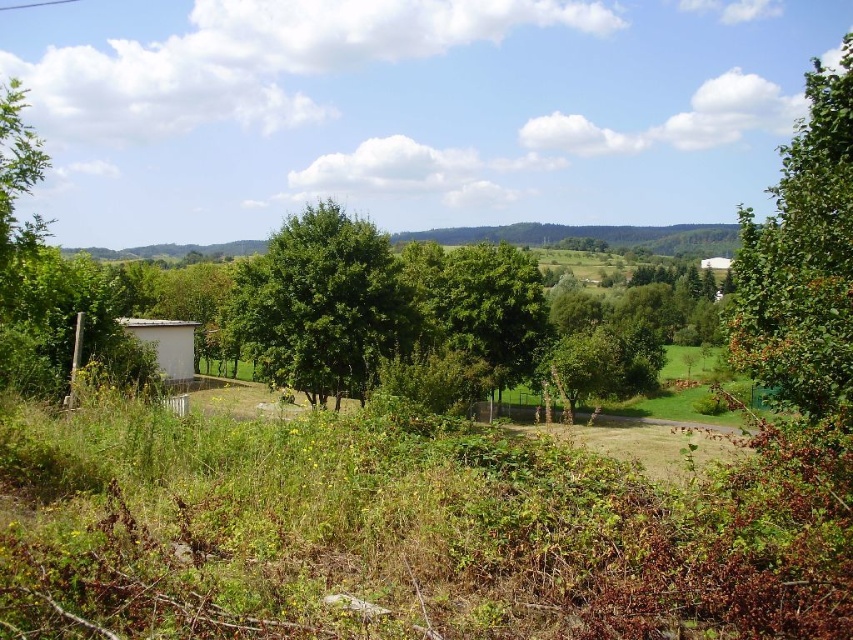
Who is shorter, green leafy tree at center or white matte hut at center?

white matte hut at center

Which is behind, point (386, 296) or point (708, 262)?

The point (708, 262) is more distant.

Identify the location of green leafy tree at center. (323, 305).

How distant is green leafy tree at center from white wood hut at lower left?

They are 8.16 meters apart.

Does green leafy tree at center have a lesser height compared to white wood hut at lower left?

No.

Between point (335, 204) and point (175, 337), which one is positioned behind?

The point (175, 337) is more distant.

Identify the location of green leafy tree at center. (323, 305).

Between green leafy tree at right and white wood hut at lower left, which one appears on the left side from the viewer's perspective?

white wood hut at lower left

Does point (788, 388) lie behind point (178, 349)?

No, (788, 388) is closer to viewer.

Between point (758, 321) and point (187, 371), which one is positioned in front?

Point (758, 321)

This screenshot has width=853, height=640. I want to click on green leafy tree at right, so coord(802,260).